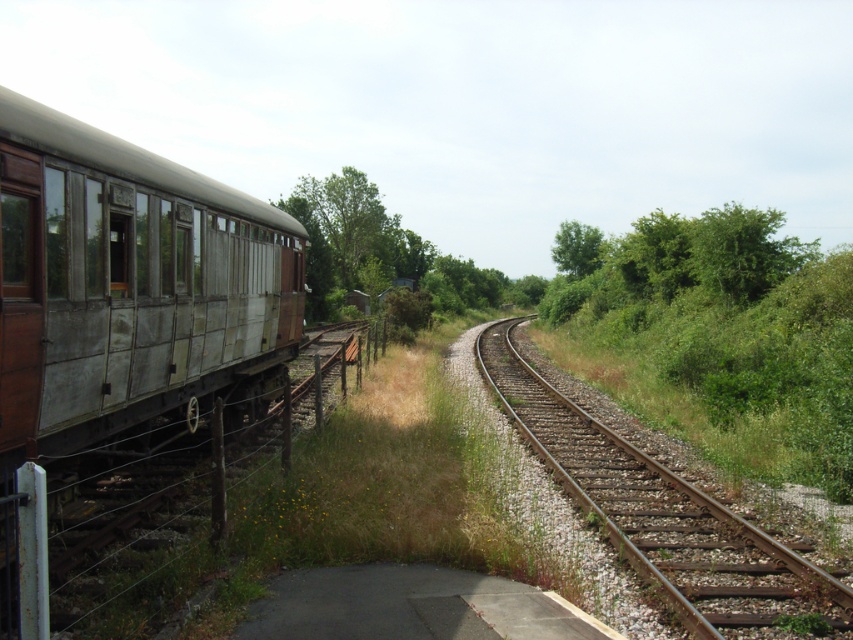
Does rusty metal train car at left appear over brown metal track at center?

Indeed, rusty metal train car at left is positioned over brown metal track at center.

Which is in front, point (44, 364) or point (636, 563)?

Point (44, 364) is in front.

You are a GUI agent. You are given a task and a screenshot of the screen. Output one action in this format:
    pyautogui.click(x=<x>, y=<y>)
    Task: Click on the rusty metal train car at left
    
    Given the screenshot: What is the action you would take?
    pyautogui.click(x=126, y=284)

Which of these two, rusty metal train car at left or rusty metal rail at left, stands shorter?

With less height is rusty metal rail at left.

Consider the image. Is rusty metal train car at left positioned in front of rusty metal rail at left?

No, it is behind rusty metal rail at left.

Where is `rusty metal train car at left`? This screenshot has width=853, height=640. rusty metal train car at left is located at coordinates (126, 284).

Image resolution: width=853 pixels, height=640 pixels. Identify the location of rusty metal train car at left. (126, 284).

Who is more distant from viewer, [300,346] or [761,566]?

The point [300,346] is behind.

Can you confirm if rusty metal rail at left is taller than brown metal track at center?

Correct, rusty metal rail at left is much taller as brown metal track at center.

This screenshot has width=853, height=640. Identify the location of rusty metal rail at left. (148, 492).